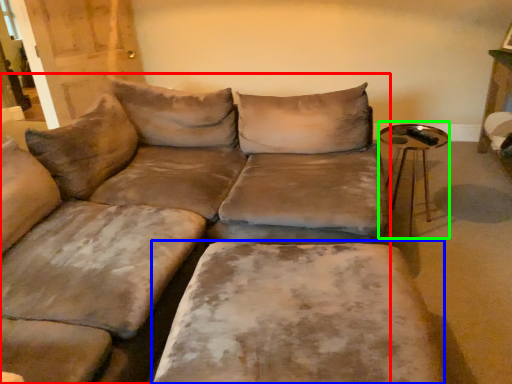
Question: Based on their relative distances, which object is farther from studio couch (highlighted by a red box)? Choose from wide (highlighted by a blue box) and side table (highlighted by a green box).

Choices:
 (A) wide
 (B) side table

Answer: (B)